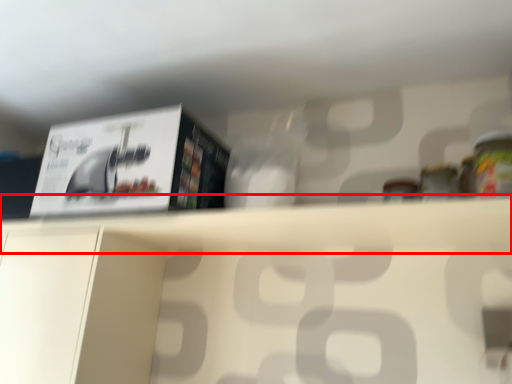
Question: In this image, where is shelf (annotated by the red box) located relative to paperback book?

Choices:
 (A) left
 (B) right

Answer: (B)